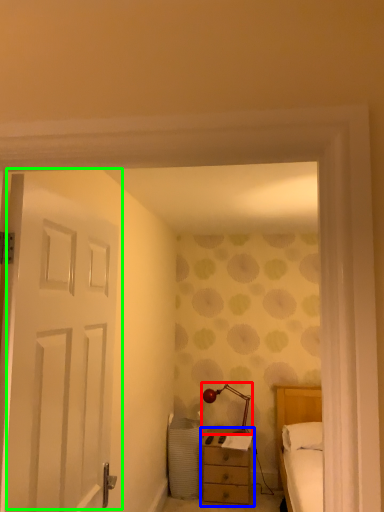
Question: Considering the real-world distances, which object is farthest from table lamp (highlighted by a red box)? nightstand (highlighted by a blue box) or door (highlighted by a green box)?

Choices:
 (A) nightstand
 (B) door

Answer: (B)